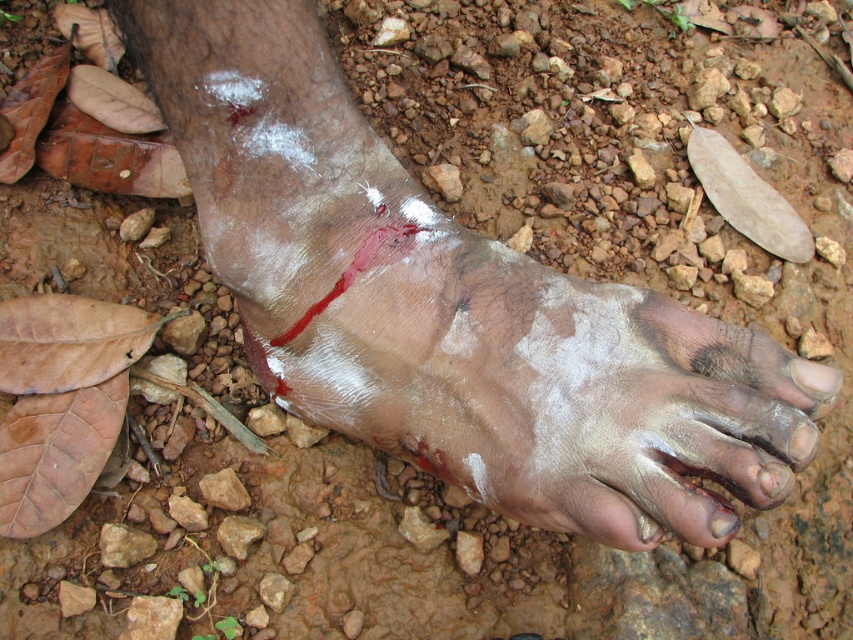
Which is more to the left, pale skin toe at center or shiny skin toe at lower right?

shiny skin toe at lower right

Does pale skin toe at center have a lesser height compared to shiny skin toe at lower right?

Incorrect, pale skin toe at center's height does not fall short of shiny skin toe at lower right's.

Is point (801, 385) positioned before point (728, 509)?

No, it is not.

Image resolution: width=853 pixels, height=640 pixels. Find the location of `pale skin toe at center`. pale skin toe at center is located at coordinates (815, 378).

Is point (157, 100) positioned after point (688, 492)?

Yes, point (157, 100) is farther from viewer.

What do you see at coordinates (450, 305) in the screenshot? I see `scabbed skin foot at center` at bounding box center [450, 305].

This screenshot has width=853, height=640. Find the location of `scabbed skin foot at center`. scabbed skin foot at center is located at coordinates (450, 305).

Is scabbed skin foot at center below pale skin toe at center?

Actually, scabbed skin foot at center is above pale skin toe at center.

Is scabbed skin foot at center positioned behind pale skin toe at center?

No, scabbed skin foot at center is in front of pale skin toe at center.

The width and height of the screenshot is (853, 640). Identify the location of scabbed skin foot at center. (450, 305).

Find the location of `scabbed skin foot at center`. scabbed skin foot at center is located at coordinates (450, 305).